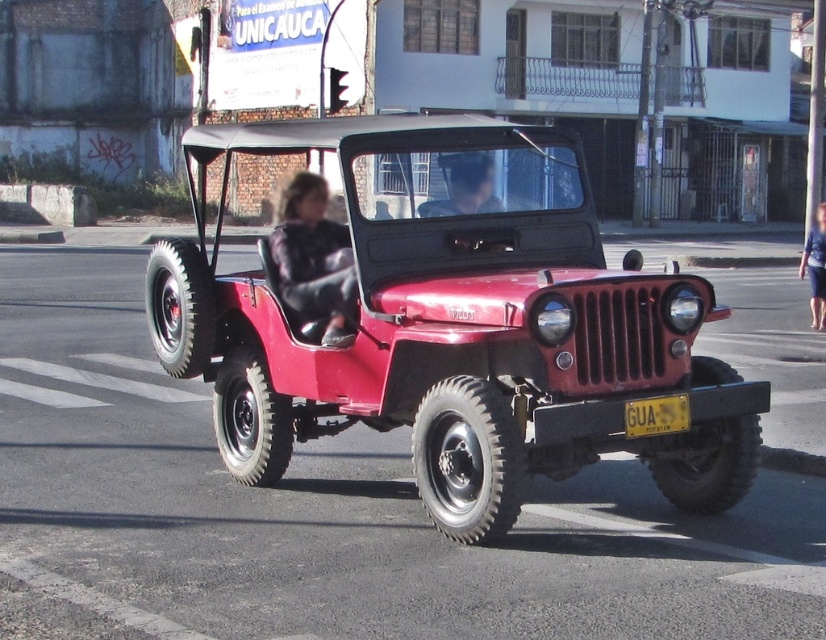
Consider the image. Can you confirm if matte black shirt at center is positioned below yellow metallic license plate at center?

No, matte black shirt at center is not below yellow metallic license plate at center.

Is matte black shirt at center bigger than yellow metallic license plate at center?

Yes.

Identify the location of matte black shirt at center. (464, 186).

Identify the location of matte black shirt at center. This screenshot has width=826, height=640. point(464,186).

How distant is shiny red jeep at center from yellow metallic license plate at center?

They are 8.66 feet apart.

Does shiny red jeep at center have a lesser height compared to yellow metallic license plate at center?

No.

Is point (568, 147) closer to camera compared to point (629, 416)?

No.

This screenshot has width=826, height=640. I want to click on shiny red jeep at center, so click(452, 324).

Is shiny red jeep at center taller than fuzzy black jacket at center?

Yes, shiny red jeep at center is taller than fuzzy black jacket at center.

Which of these two, shiny red jeep at center or fuzzy black jacket at center, stands taller?

Standing taller between the two is shiny red jeep at center.

Does point (491, 538) lie behind point (282, 186)?

No.

Identify the location of shiny red jeep at center. Image resolution: width=826 pixels, height=640 pixels. coord(452,324).